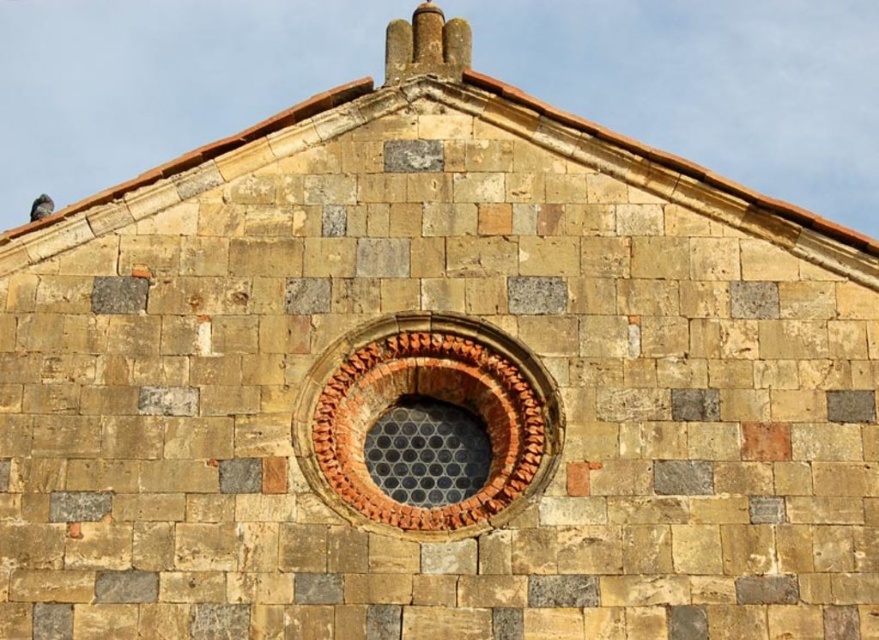
Question: Can you confirm if terracotta brick window at center is wider than gray feathered pigeon at upper left?

Choices:
 (A) yes
 (B) no

Answer: (B)

Question: Which point is closer to the camera?

Choices:
 (A) (368, 396)
 (B) (45, 200)

Answer: (A)

Question: Is terracotta brick window at center positioned before gray feathered pigeon at upper left?

Choices:
 (A) yes
 (B) no

Answer: (A)

Question: Which object appears farthest from the camera in this image?

Choices:
 (A) gray feathered pigeon at upper left
 (B) terracotta brick window at center

Answer: (A)

Question: Does terracotta brick window at center appear on the left side of gray feathered pigeon at upper left?

Choices:
 (A) yes
 (B) no

Answer: (B)